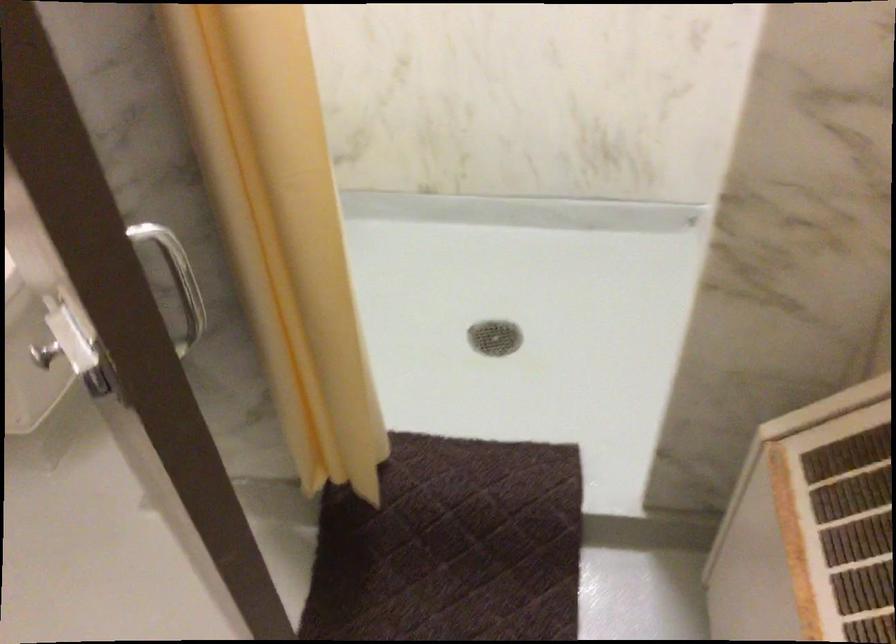
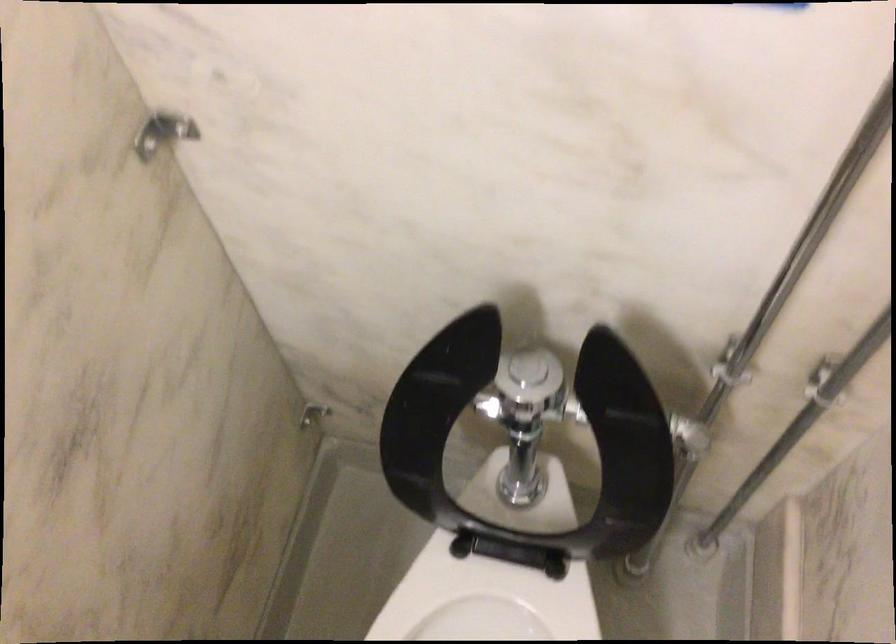
The images are taken continuously from a first-person perspective. In which direction are you moving?

The cameraman moved toward left, forward.